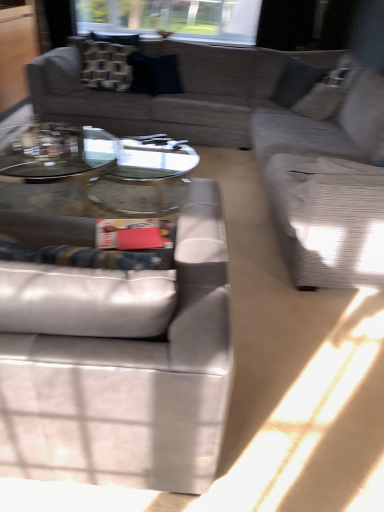
Question: From the image's perspective, is clear glass coffee table at center on top of transparent glass window at upper center?

Choices:
 (A) no
 (B) yes

Answer: (A)

Question: Is the depth of clear glass coffee table at center less than that of transparent glass window at upper center?

Choices:
 (A) yes
 (B) no

Answer: (A)

Question: Is clear glass coffee table at center with transparent glass window at upper center?

Choices:
 (A) no
 (B) yes

Answer: (A)

Question: From the image's perspective, is clear glass coffee table at center located beneath transparent glass window at upper center?

Choices:
 (A) no
 (B) yes

Answer: (B)

Question: Is clear glass coffee table at center completely or partially outside of transparent glass window at upper center?

Choices:
 (A) no
 (B) yes

Answer: (B)

Question: From the image's perspective, is textured gray couch at right positioned above or below leather couch at lower left, which is the 1th studio couch in bottom-to-top order?

Choices:
 (A) below
 (B) above

Answer: (B)

Question: Looking at their shapes, would you say textured gray couch at right is wider or thinner than leather couch at lower left, positioned as the 1th studio couch in front-to-back order?

Choices:
 (A) thin
 (B) wide

Answer: (B)

Question: Does point (324, 113) appear closer or farther from the camera than point (188, 300)?

Choices:
 (A) closer
 (B) farther

Answer: (B)

Question: Based on their positions, is textured gray couch at right located to the left or right of leather couch at lower left, positioned as the 1th studio couch in front-to-back order?

Choices:
 (A) right
 (B) left

Answer: (A)

Question: In terms of width, does leather couch at lower left, which is the 1th studio couch in bottom-to-top order, look wider or thinner when compared to patterned fabric pillow at upper left, marked as the second pillow in a right-to-left arrangement?

Choices:
 (A) wide
 (B) thin

Answer: (A)

Question: Is leather couch at lower left, which is the 2th studio couch in top-to-bottom order, inside or outside of patterned fabric pillow at upper left, marked as the second pillow in a right-to-left arrangement?

Choices:
 (A) outside
 (B) inside

Answer: (A)

Question: Relative to patterned fabric pillow at upper left, acting as the first pillow starting from the left, is leather couch at lower left, positioned as the 1th studio couch in front-to-back order, in front or behind?

Choices:
 (A) behind
 (B) front

Answer: (B)

Question: From the image's perspective, is leather couch at lower left, positioned as the second studio couch in back-to-front order, located above or below patterned fabric pillow at upper left, acting as the first pillow starting from the left?

Choices:
 (A) above
 (B) below

Answer: (B)

Question: From the image's perspective, is clear glass coffee table at center above or below patterned fabric pillow at upper left, marked as the second pillow in a right-to-left arrangement?

Choices:
 (A) above
 (B) below

Answer: (B)

Question: Is point [x=3, y=174] closer or farther from the camera than point [x=117, y=55]?

Choices:
 (A) farther
 (B) closer

Answer: (B)